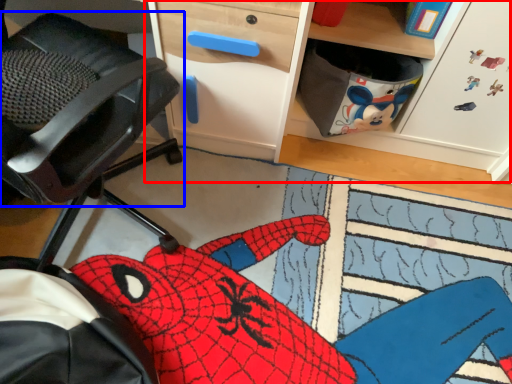
Question: Among these objects, which one is nearest to the camera, computer desk (highlighted by a red box) or chair (highlighted by a blue box)?

Choices:
 (A) computer desk
 (B) chair

Answer: (B)